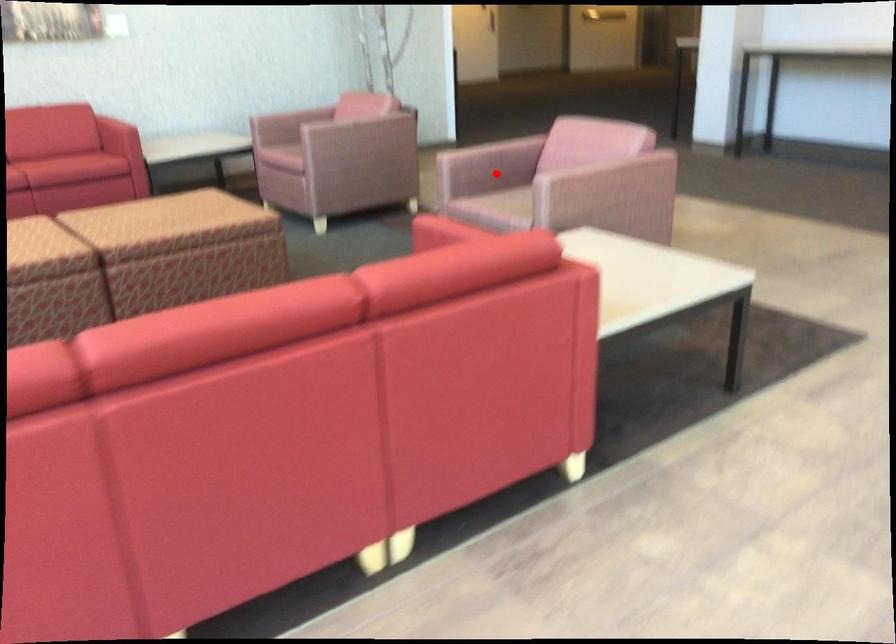
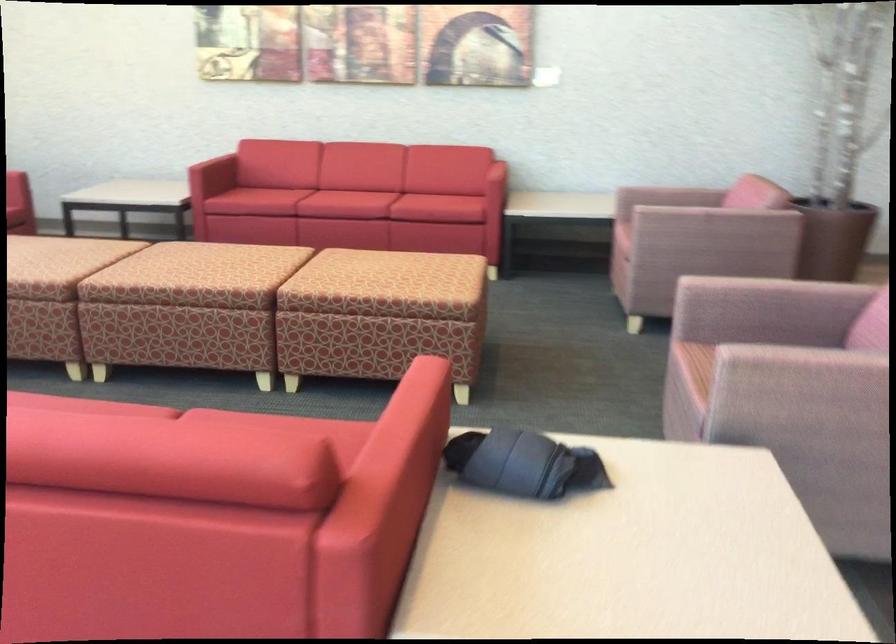
Where in the second image is the point corresponding to the highlighted location from the first image?

(760, 330)